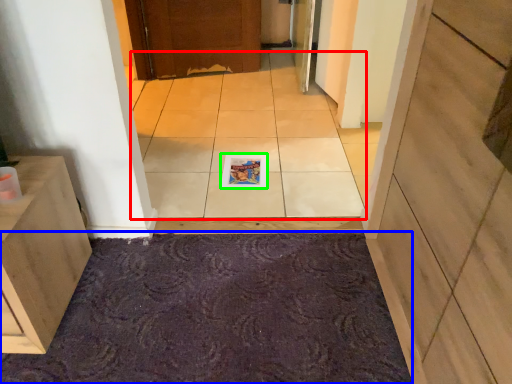
Question: Considering the real-world distances, which object is closest to ceramic tile (highlighted by a red box)? bath mat (highlighted by a blue box) or magazine (highlighted by a green box).

Choices:
 (A) bath mat
 (B) magazine

Answer: (B)